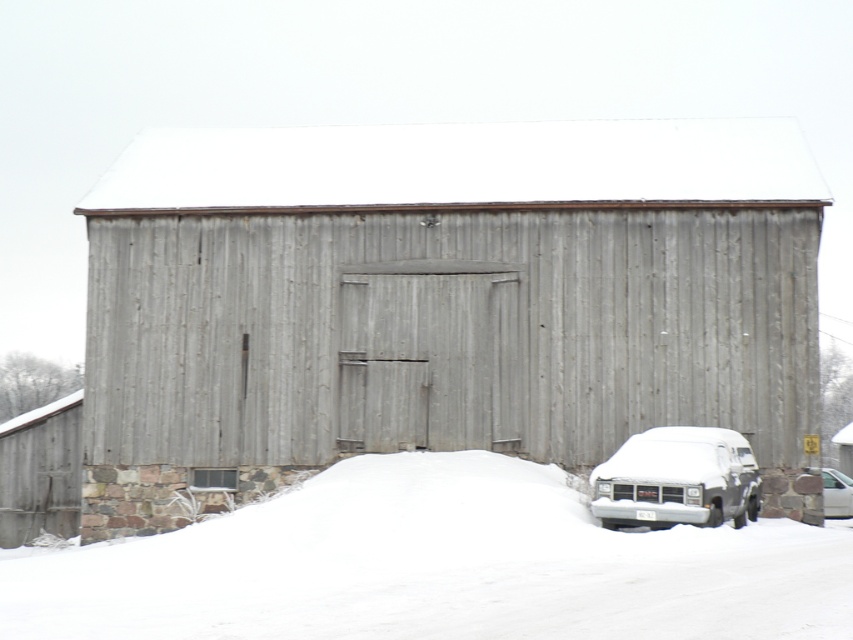
Is white fluffy snow at lower center positioned in front of snow-covered van at lower right?

Yes, it is.

Does point (581, 602) lie in front of point (703, 448)?

Yes, point (581, 602) is closer to viewer.

You are a GUI agent. You are given a task and a screenshot of the screen. Output one action in this format:
    pyautogui.click(x=<x>, y=<y>)
    Task: Click on the white fluffy snow at lower center
    Image resolution: width=853 pixels, height=640 pixels.
    Given the screenshot: What is the action you would take?
    pyautogui.click(x=434, y=566)

Which is above, weathered wood barn at center or snow-covered van at lower right?

weathered wood barn at center is higher up.

Does weathered wood barn at center have a greater width compared to snow-covered van at lower right?

Correct, the width of weathered wood barn at center exceeds that of snow-covered van at lower right.

The image size is (853, 640). What are the coordinates of `weathered wood barn at center` in the screenshot? It's located at (439, 298).

Is weathered wood barn at center wider than white fluffy snow at lower center?

No, weathered wood barn at center is not wider than white fluffy snow at lower center.

From the picture: Who is more distant from viewer, (534, 458) or (372, 588)?

Point (534, 458)

Consider the image. Who is more forward, (612,365) or (154,557)?

Point (154,557) is in front.

The image size is (853, 640). I want to click on weathered wood barn at center, so click(x=439, y=298).